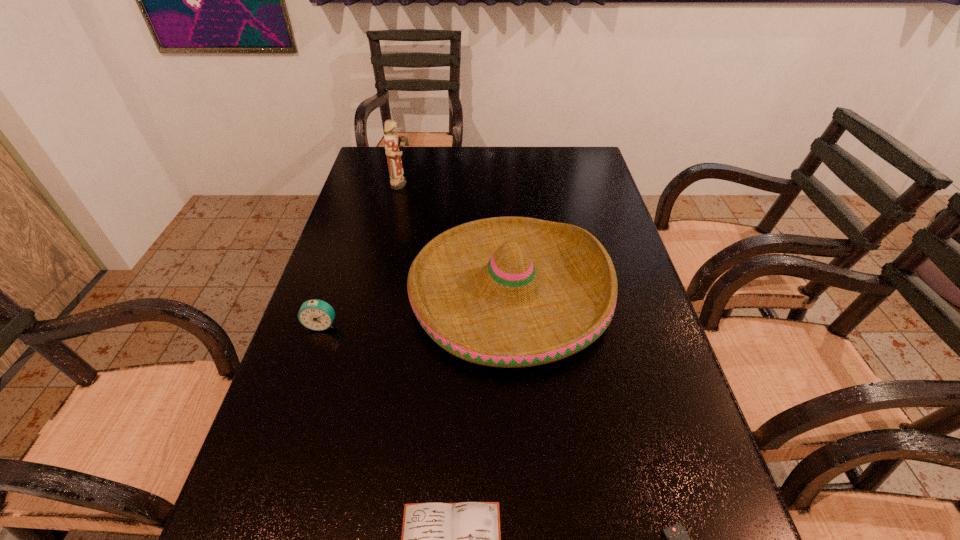
Where is `alarm clock positioned at the left edge`? This screenshot has width=960, height=540. alarm clock positioned at the left edge is located at coordinates (318, 315).

Find the location of `object at the right edge`. object at the right edge is located at coordinates (510, 292).

The width and height of the screenshot is (960, 540). I want to click on object situated at the far left corner, so click(397, 181).

In order to click on blank area at the left edge in this screenshot , I will do `click(373, 197)`.

At what (x,y) coordinates should I click in order to perform the action: click on vacant space at the right edge. Please return your answer as a coordinate pair (x, y). The width and height of the screenshot is (960, 540). Looking at the image, I should click on (596, 346).

Locate an element on the screen. This screenshot has height=540, width=960. blank area at the far left corner is located at coordinates (411, 156).

Where is `vacant area at the far right corner of the desktop`? vacant area at the far right corner of the desktop is located at coordinates (598, 173).

Where is `free space between the fourth object from right to left and the third tallest object`? The image size is (960, 540). free space between the fourth object from right to left and the third tallest object is located at coordinates (362, 254).

Where is `unoccupied position between the figurine and the leftmost object`? unoccupied position between the figurine and the leftmost object is located at coordinates (362, 254).

Find the location of a particular element. This screenshot has height=540, width=960. free spot between the second object from left to right and the leftmost object is located at coordinates (362, 254).